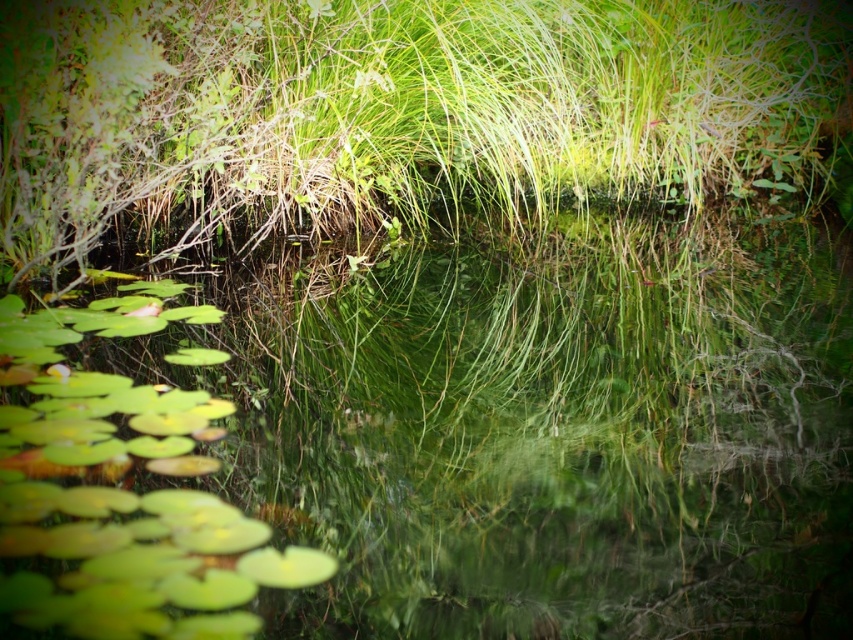
Question: Can you confirm if green grass at center is positioned to the left of green glossy lily pads at lower left?

Choices:
 (A) no
 (B) yes

Answer: (B)

Question: Which object is farther from the camera taking this photo?

Choices:
 (A) green grass at center
 (B) green glossy lily pads at lower left

Answer: (A)

Question: Is green grass at center positioned at the back of green glossy lily pads at lower left?

Choices:
 (A) yes
 (B) no

Answer: (A)

Question: Among these objects, which one is farthest from the camera?

Choices:
 (A) green grass at center
 (B) green glossy lily pads at lower left

Answer: (A)

Question: Does green grass at center have a smaller size compared to green glossy lily pads at lower left?

Choices:
 (A) yes
 (B) no

Answer: (A)